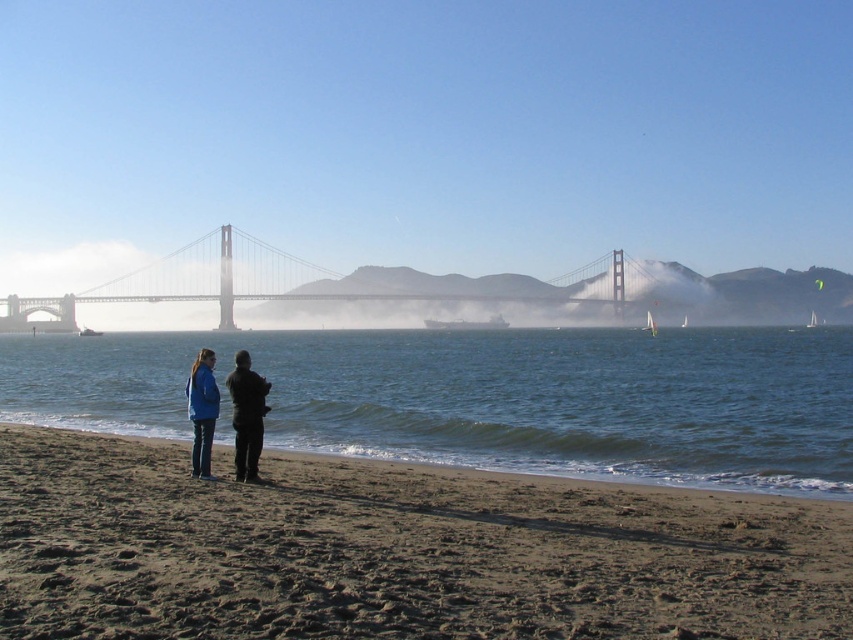
Which of these two, brown sand at lower center or blue water at lower center, stands shorter?

brown sand at lower center

Can you confirm if brown sand at lower center is positioned to the left of blue water at lower center?

Yes, brown sand at lower center is to the left of blue water at lower center.

You are a GUI agent. You are given a task and a screenshot of the screen. Output one action in this format:
    pyautogui.click(x=<x>, y=<y>)
    Task: Click on the brown sand at lower center
    This screenshot has width=853, height=640.
    Given the screenshot: What is the action you would take?
    pyautogui.click(x=395, y=550)

Does blue water at lower center appear on the right side of black matte jacket at center?

Correct, you'll find blue water at lower center to the right of black matte jacket at center.

Is blue water at lower center taller than black matte jacket at center?

Correct, blue water at lower center is much taller as black matte jacket at center.

Who is more forward, (660, 371) or (244, 429)?

Point (244, 429) is more forward.

At what (x,y) coordinates should I click in order to perform the action: click on blue water at lower center. Please return your answer as a coordinate pair (x, y). The width and height of the screenshot is (853, 640). Looking at the image, I should click on (486, 397).

What do you see at coordinates (247, 416) in the screenshot? The height and width of the screenshot is (640, 853). I see `black matte jacket at center` at bounding box center [247, 416].

Can you confirm if black matte jacket at center is positioned below blue fabric jacket at lower left?

Actually, black matte jacket at center is above blue fabric jacket at lower left.

Is point (245, 412) positioned in front of point (201, 460)?

Yes, point (245, 412) is closer to viewer.

The image size is (853, 640). What are the coordinates of `black matte jacket at center` in the screenshot? It's located at (247, 416).